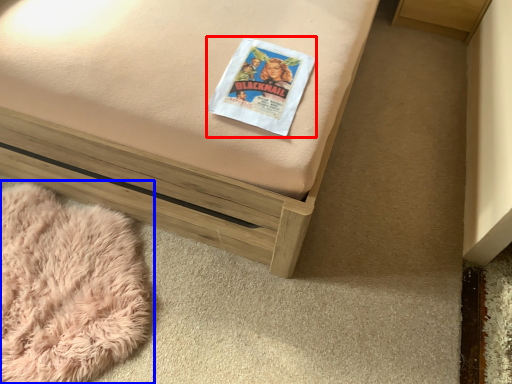
Question: Which object appears farthest to the camera in this image, paperback book (highlighted by a red box) or blanket (highlighted by a blue box)?

Choices:
 (A) paperback book
 (B) blanket

Answer: (B)